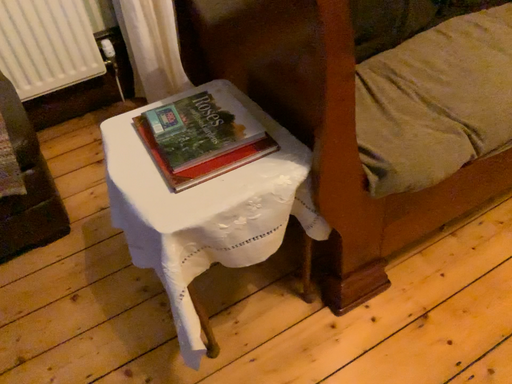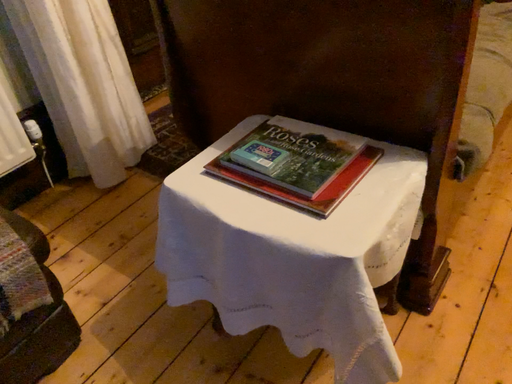
Question: How did the camera likely rotate when shooting the video?

Choices:
 (A) rotated right
 (B) rotated left

Answer: (A)